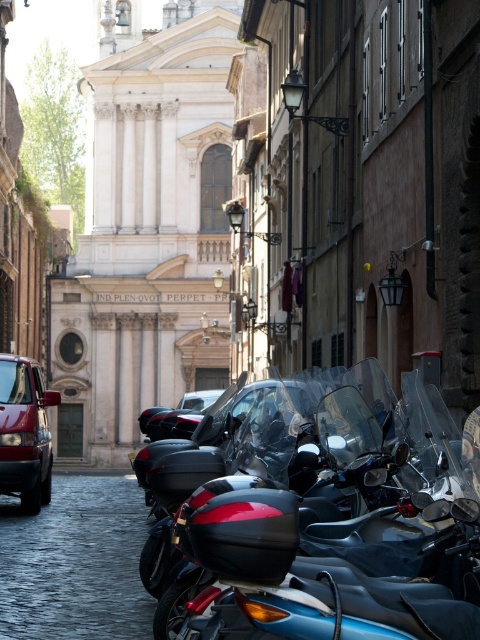
This screenshot has width=480, height=640. In order to click on black glossy motorcycle at center in this screenshot , I will do `click(324, 566)`.

Between black glossy motorcycle at center and matte red van at left, which one has more height?

Standing taller between the two is matte red van at left.

The image size is (480, 640). What are the coordinates of `black glossy motorcycle at center` in the screenshot? It's located at (324, 566).